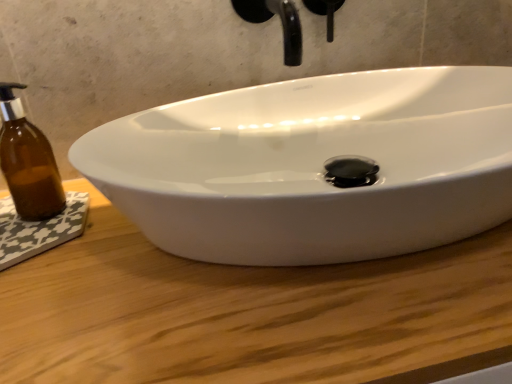
Question: Is black matte faucet at upper center in front of or behind wooden at center in the image?

Choices:
 (A) behind
 (B) front

Answer: (A)

Question: Visually, is black matte faucet at upper center positioned to the left or to the right of wooden at center?

Choices:
 (A) right
 (B) left

Answer: (B)

Question: Estimate the real-world distances between objects in this image. Which object is closer to the brown glass bottle at left?

Choices:
 (A) wooden at center
 (B) black matte faucet at upper center

Answer: (A)

Question: Estimate the real-world distances between objects in this image. Which object is closer to the black matte faucet at upper center?

Choices:
 (A) wooden at center
 (B) brown glass bottle at left

Answer: (A)